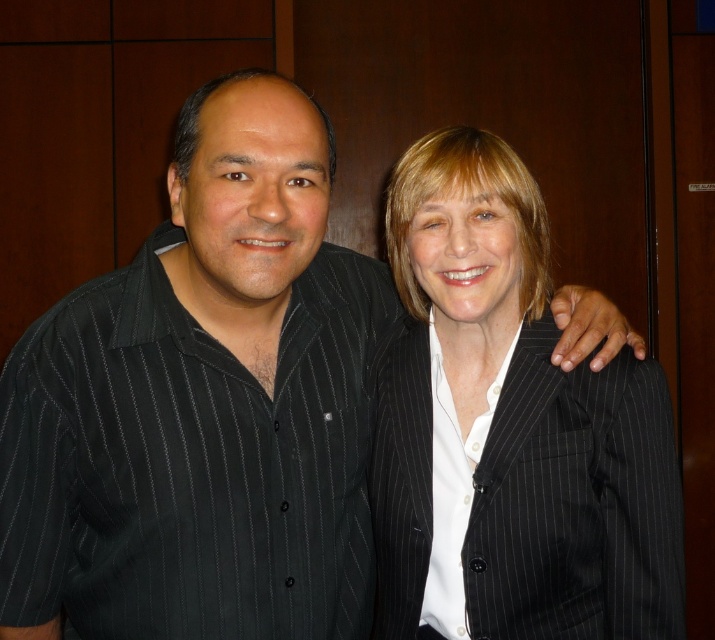
Based on the photo, you are a photographer setting up a photo shoot with two subjects. You have a camera that requires the subject to be taller than the other to frame properly. You see the black pinstripe suit at right and the white smooth shirt at center. Which one should you choose as the main subject to ensure proper framing?

The black pinstripe suit at right is taller than the white smooth shirt at center, so you should choose the black pinstripe suit at right as the main subject to ensure proper framing.

You are a photographer setting up a photo shoot for two people. You have a backdrop and need to arrange the black pinstripe suit at right and the white smooth shirt at center. Based on their sizes, which clothing item should be placed closer to the camera to avoid overlapping?

The black pinstripe suit at right is larger in size compared to the white smooth shirt at center. To prevent overlapping, the larger black pinstripe suit at right should be placed closer to the camera so that the smaller white smooth shirt at center can be positioned behind it without obstruction.

Consider the image. You are a photographer setting up for a portrait session. You have two subjects wearing the black pinstripe suit at right and the white smooth shirt at center. You need to adjust the lighting so that the subject closer to the camera is well lit. Which subject should you focus the light on?

The black pinstripe suit at right is closer to the viewer than the white smooth shirt at center, so you should focus the light on the black pinstripe suit at right to ensure proper illumination.